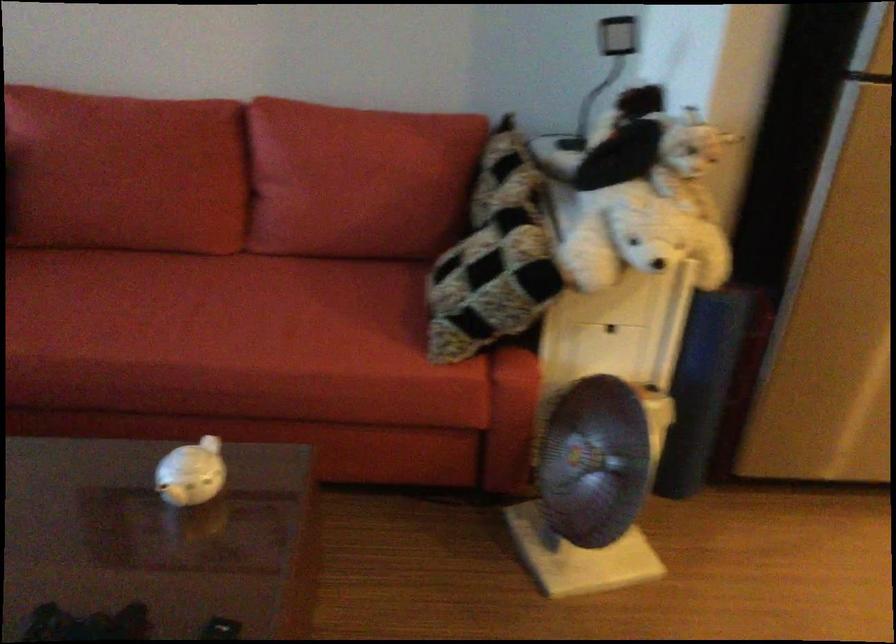
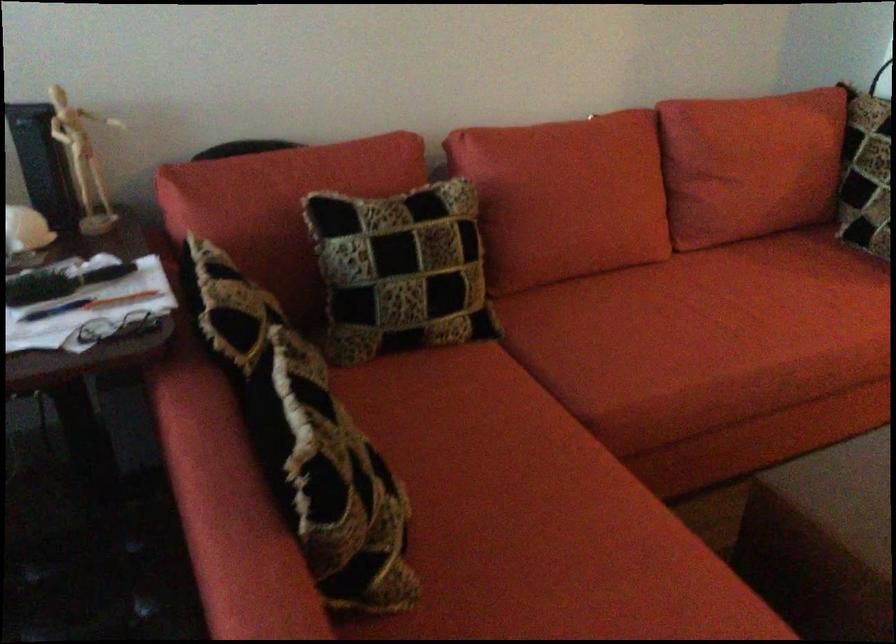
Find the pixel in the second image that matches the point at 140,317 in the first image.

(726, 323)